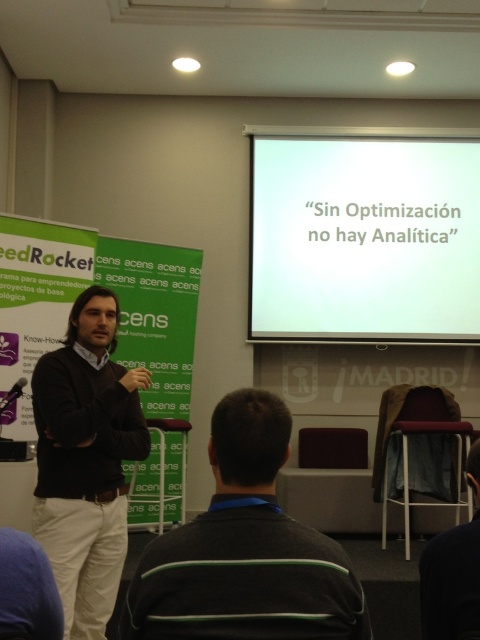
You are organizing a charity event and need to decide which sweater to donate. Both the black sweater at center and the dark brown sweater at center are available. Based on their sizes, which one would you choose if you want to donate the larger one?

The dark brown sweater at center is larger than the black sweater at center, so you should choose the dark brown sweater at center for donation if you want the larger size.

You are standing in the presentation room and want to locate the black sweater at center. According to the coordinates provided, where exactly should you look?

The black sweater at center is located at point coordinates of (244, 550).

You are an event planner setting up the room for a presentation. You need to decide whether the white matte projection screen at upper center will be tall enough to display content clearly for the audience. Considering the height of the dark brown sweater at center, can you determine if the screen is sufficiently tall?

The white matte projection screen at upper center has a greater height compared to the dark brown sweater at center, so it should be tall enough to display content clearly for the audience.